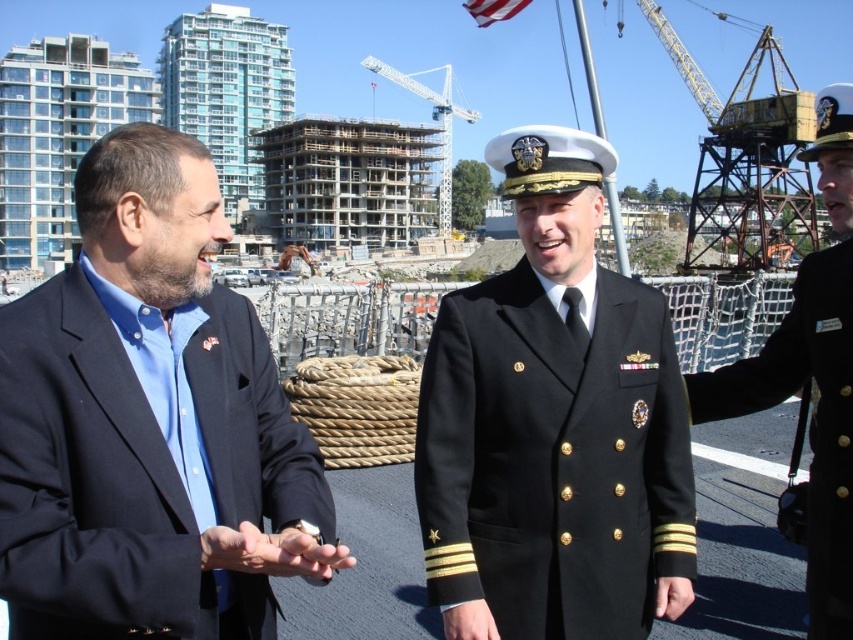
Question: Which is farther from the blue fabric shirt at left?

Choices:
 (A) black uniform at center
 (B) black woolen military uniform at center

Answer: (A)

Question: Is blue fabric shirt at left bigger than black uniform at center?

Choices:
 (A) no
 (B) yes

Answer: (A)

Question: Which point appears farthest from the camera in this image?

Choices:
 (A) (659, 346)
 (B) (251, 419)

Answer: (A)

Question: From the image, what is the correct spatial relationship of blue fabric shirt at left in relation to black woolen military uniform at center?

Choices:
 (A) above
 (B) below

Answer: (A)

Question: Estimate the real-world distances between objects in this image. Which object is farther from the black uniform at center?

Choices:
 (A) black woolen military uniform at center
 (B) blue fabric shirt at left

Answer: (B)

Question: Is black woolen military uniform at center bigger than black uniform at center?

Choices:
 (A) no
 (B) yes

Answer: (A)